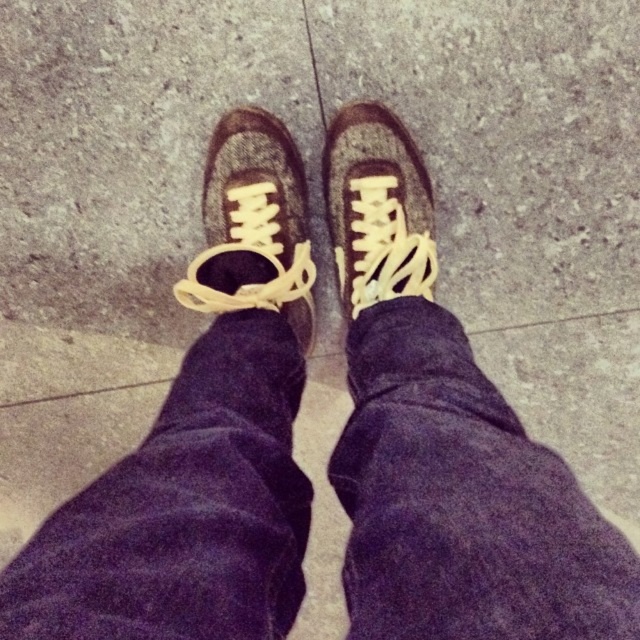
Question: Which of the following is the closest to the observer?

Choices:
 (A) matte brown shoe at center
 (B) leather shoe at center

Answer: (B)

Question: Can you confirm if leather shoe at center is thinner than matte brown shoe at center?

Choices:
 (A) no
 (B) yes

Answer: (A)

Question: Which of the following is the farthest from the observer?

Choices:
 (A) (250, 225)
 (B) (348, 308)

Answer: (B)

Question: Does leather shoe at center come in front of matte brown shoe at center?

Choices:
 (A) no
 (B) yes

Answer: (B)

Question: Considering the relative positions of leather shoe at center and matte brown shoe at center in the image provided, where is leather shoe at center located with respect to matte brown shoe at center?

Choices:
 (A) right
 (B) left

Answer: (B)